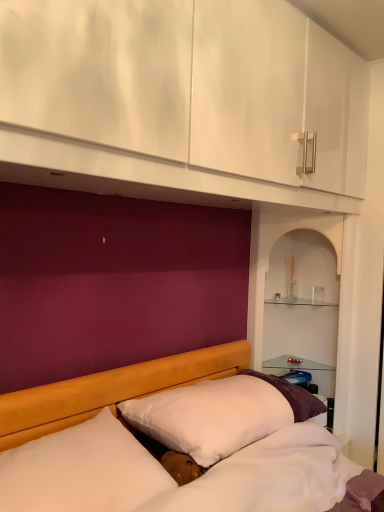
Question: In terms of width, does clear glass shelves at right, which ranks as the 2th shelf in top-to-bottom order, look wider or thinner when compared to clear glass shelf at upper center, placed as the 1th shelf when sorted from top to bottom?

Choices:
 (A) thin
 (B) wide

Answer: (B)

Question: Is clear glass shelves at right, which ranks as the 2th shelf in top-to-bottom order, taller or shorter than clear glass shelf at upper center, the 2th shelf when ordered from bottom to top?

Choices:
 (A) tall
 (B) short

Answer: (A)

Question: Estimate the real-world distances between objects in this image. Which object is closer to the clear glass shelves at right, which ranks as the 2th shelf in top-to-bottom order?

Choices:
 (A) clear glass shelf at upper center, the 2th shelf when ordered from bottom to top
 (B) white soft pillow at center, the 1th pillow when ordered from back to front
 (C) white soft pillow at lower left, positioned as the 2th pillow in back-to-front order

Answer: (A)

Question: Based on their relative distances, which object is farther from the white soft pillow at lower left, positioned as the 2th pillow in back-to-front order?

Choices:
 (A) white soft pillow at center, the 1th pillow when ordered from back to front
 (B) clear glass shelf at upper center, placed as the 1th shelf when sorted from top to bottom
 (C) clear glass shelves at right, arranged as the 1th shelf when ordered from the bottom

Answer: (B)